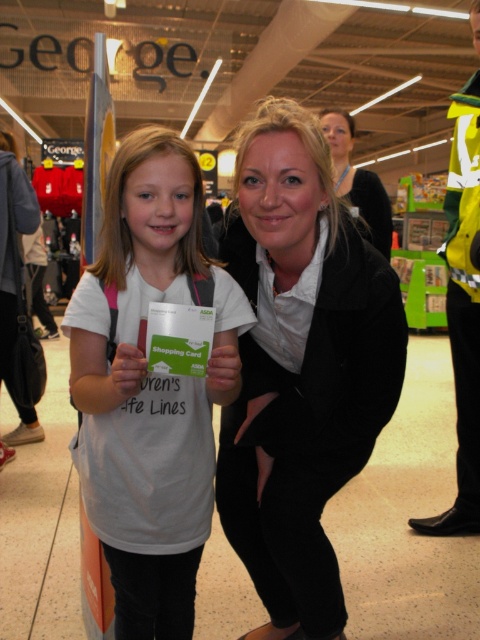
You are a customer in the store and want to see both the black matte coat at center and the matte black jacket at upper center. Which one is closer to you?

The black matte coat at center is closer to you because it is in front of the matte black jacket at upper center.